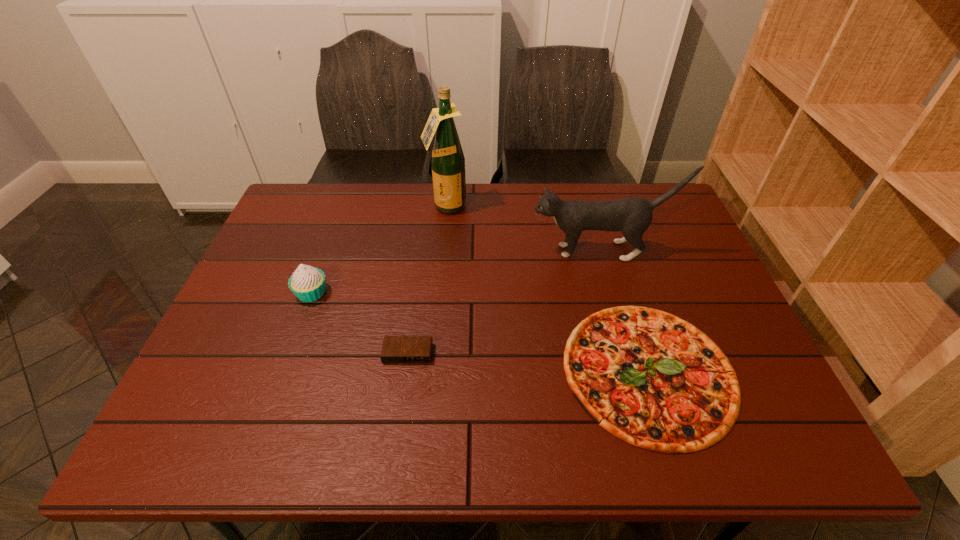
Where is `vacant region located at the face of the second tallest object`? The height and width of the screenshot is (540, 960). vacant region located at the face of the second tallest object is located at coordinates (486, 251).

Locate an element on the screen. This screenshot has height=540, width=960. free location located 0.300m at the face of the second tallest object is located at coordinates (427, 251).

You are a GUI agent. You are given a task and a screenshot of the screen. Output one action in this format:
    pyautogui.click(x=<x>, y=<y>)
    Task: Click on the free spot located on the right of the leftmost object
    This screenshot has width=960, height=540.
    Given the screenshot: What is the action you would take?
    pyautogui.click(x=462, y=293)

The width and height of the screenshot is (960, 540). Find the location of `vacant space situated 0.150m on the front face of the second shortest object`. vacant space situated 0.150m on the front face of the second shortest object is located at coordinates (397, 426).

Locate an element on the screen. free region located on the left of the shortest object is located at coordinates (458, 370).

Identify the location of object that is at the far edge. (447, 160).

The image size is (960, 540). Identify the location of object that is positioned at the near edge. (650, 378).

The width and height of the screenshot is (960, 540). What are the coordinates of `object at the left edge` in the screenshot? It's located at (308, 284).

I want to click on cat that is at the right edge, so click(632, 216).

Where is `pizza positioned at the right edge`? The height and width of the screenshot is (540, 960). pizza positioned at the right edge is located at coordinates (650, 378).